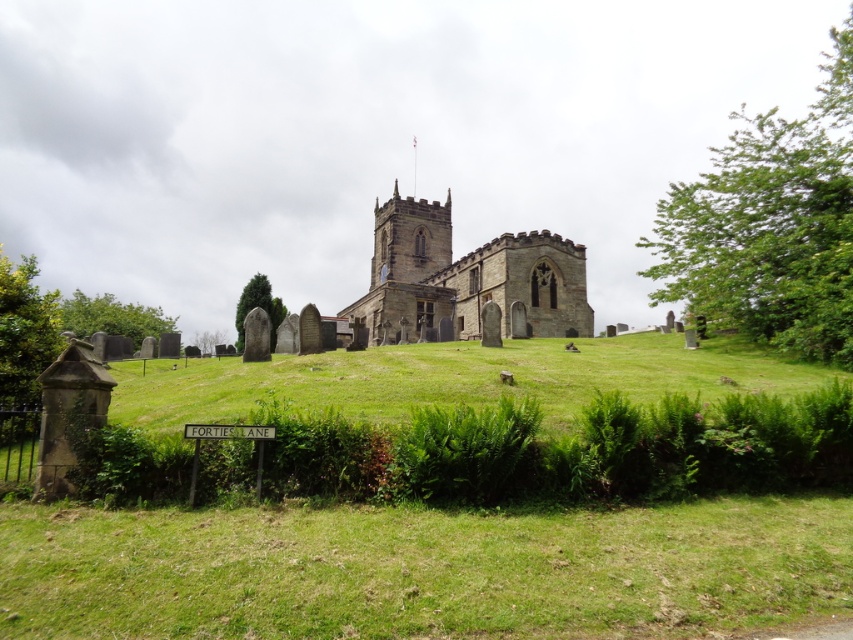
You are a landscape architect designing a new garden path that needs to pass between the green leafy tree at upper right and the green textured stone at center. Based on the scene, can you determine if the space between them is wide enough for a standard garden path that is 2 meters wide?

The green leafy tree at upper right might be wider than green textured stone at center, so the space between them may not be wide enough for a 2 meter garden path. Further measurements would be needed to confirm.

You are standing at the camera position and want to reach the point marked at coordinates point (427, 296). If your walking speed is 3 feet per second, how many seconds will it take you to reach that point?

The distance between you and the point marked at coordinates point (427, 296) is 432.42 feet. At a walking speed of 3 feet per second, it will take you 144.14 seconds to reach that point.